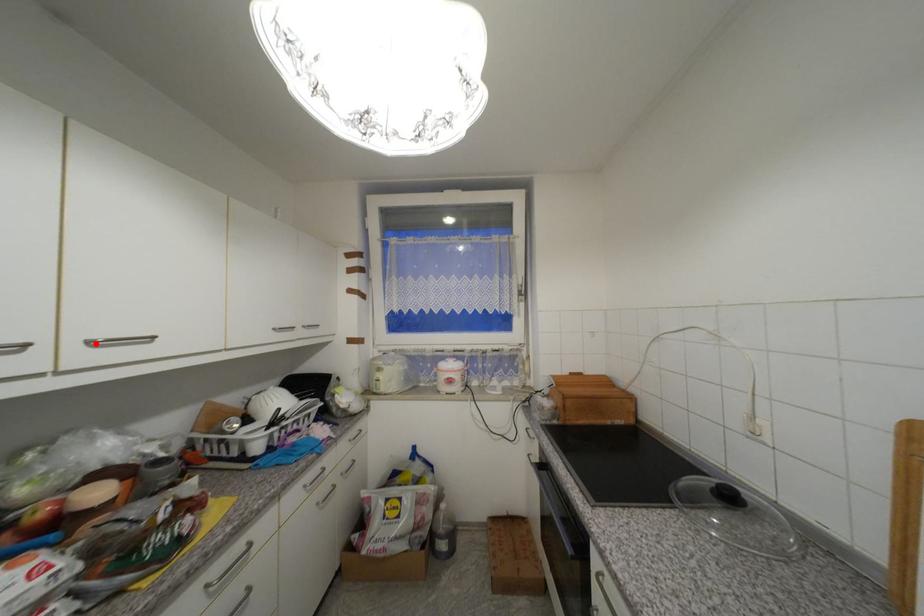
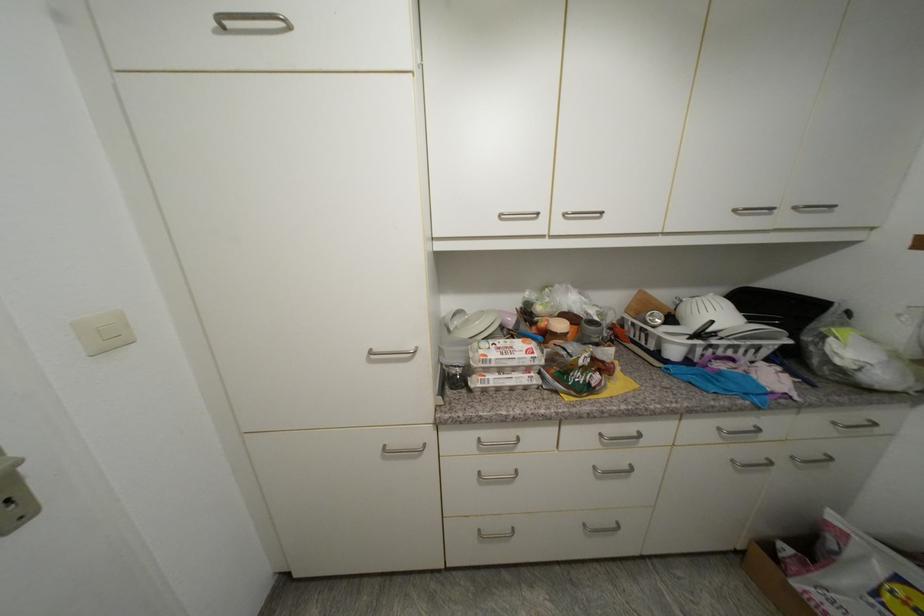
Locate, in the second image, the point that corresponds to the highlighted location in the first image.

(570, 216)